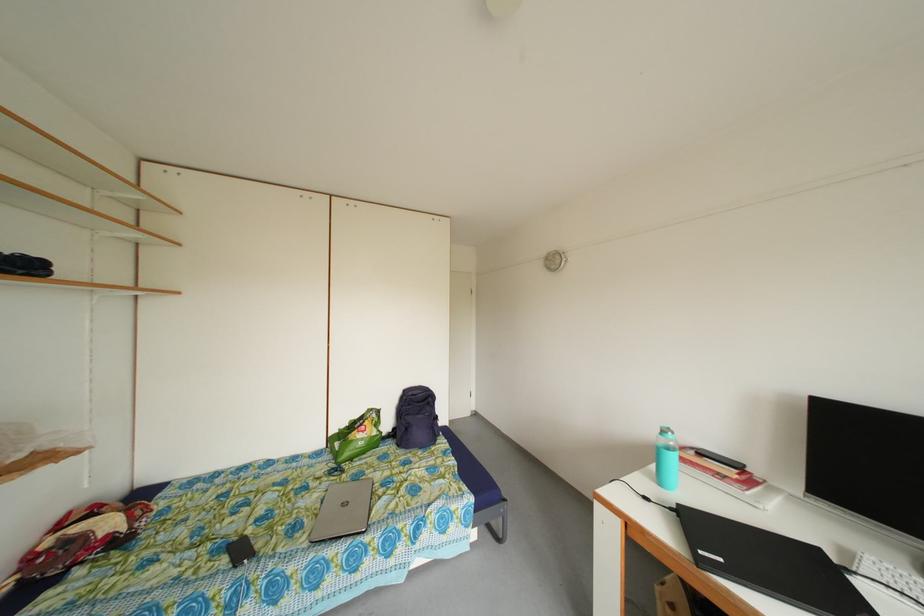
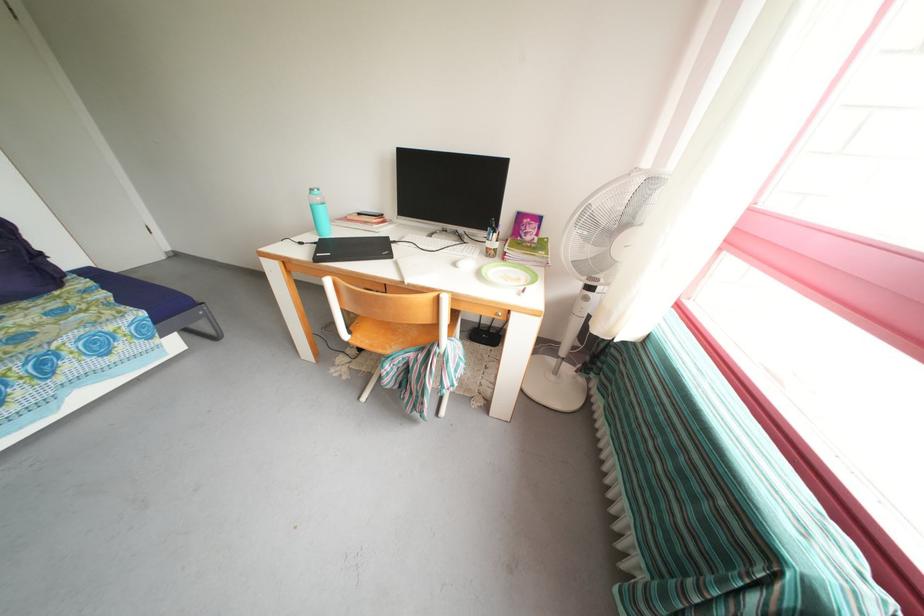
Locate, in the second image, the point that corresponds to point 678,515 in the first image.

(322, 249)